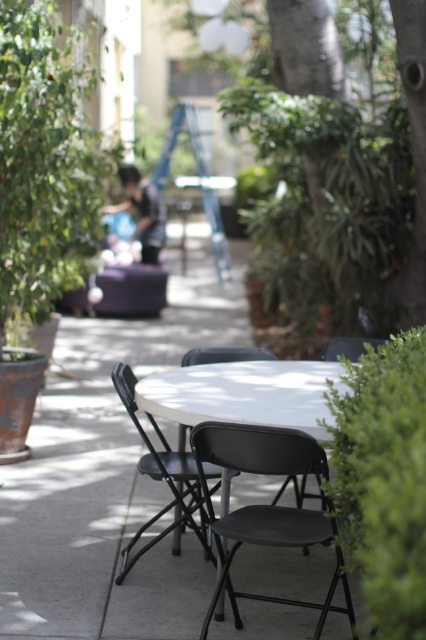
Does black plastic folding chair at center have a lesser width compared to black plastic chair at center?

No.

Which of these two, black plastic folding chair at center or black plastic chair at center, stands shorter?

black plastic folding chair at center

This screenshot has width=426, height=640. Find the location of `black plastic folding chair at center`. black plastic folding chair at center is located at coordinates (267, 506).

Where is `black plastic folding chair at center`? This screenshot has height=640, width=426. black plastic folding chair at center is located at coordinates (267, 506).

Is white matte table at center smaller than black plastic chair at center?

Yes.

Who is lower down, white matte table at center or black plastic chair at center?

black plastic chair at center is below.

Does point (216, 412) lie in front of point (131, 544)?

Yes.

What are the coordinates of `white matte table at center` in the screenshot? It's located at (244, 394).

Does green leafy tree at upper left have a lesser width compared to black plastic chair at center?

No, green leafy tree at upper left is not thinner than black plastic chair at center.

Which is above, green leafy tree at upper left or black plastic chair at center?

green leafy tree at upper left

Who is more distant from viewer, (85, 144) or (195, 461)?

The point (85, 144) is more distant.

This screenshot has width=426, height=640. Identify the location of green leafy tree at upper left. (45, 163).